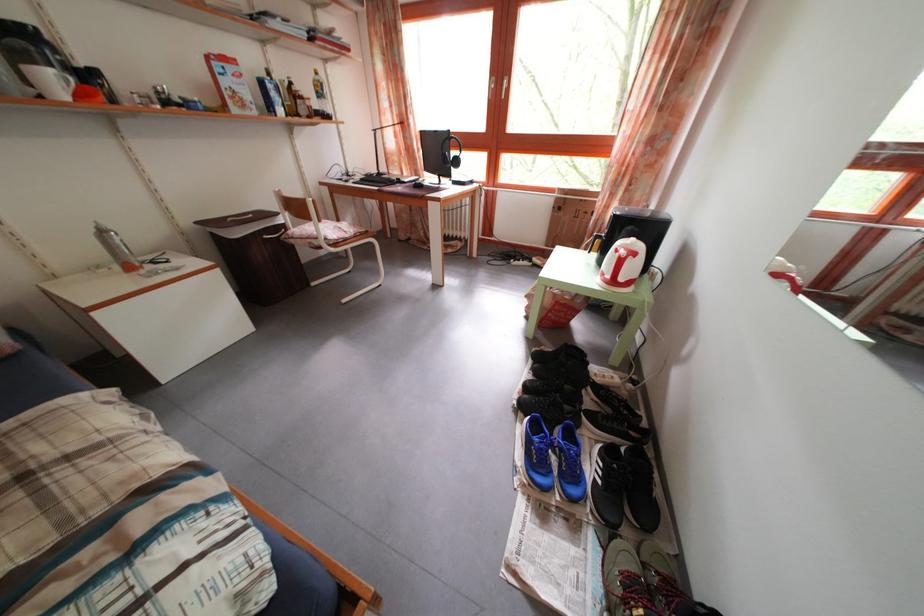
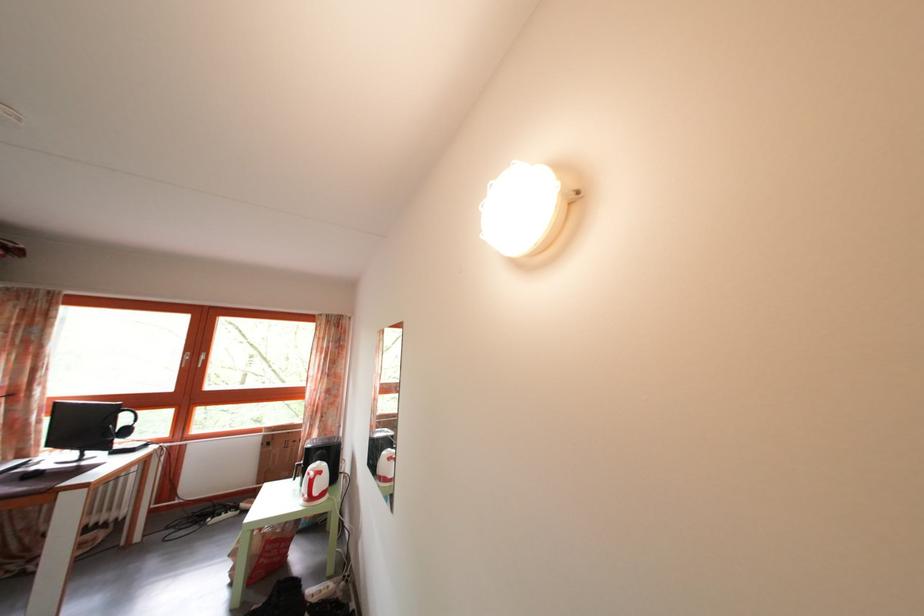
Find the pixel in the second image that matches point (464, 180) in the first image.

(128, 451)